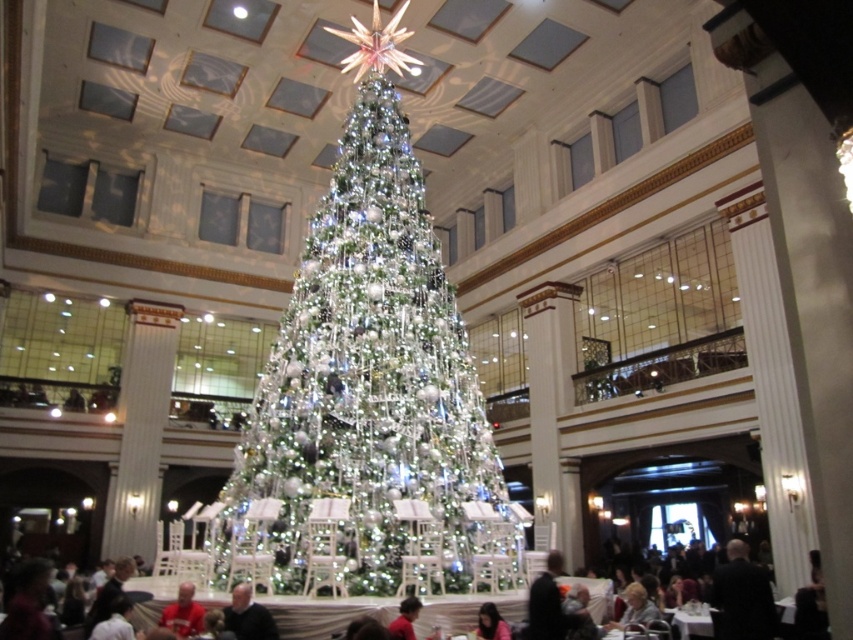
Which is above, iridescent glass christmas tree at center or smooth pink shirt at lower center?

iridescent glass christmas tree at center is above.

Is iridescent glass christmas tree at center to the left of smooth pink shirt at lower center from the viewer's perspective?

Indeed, iridescent glass christmas tree at center is positioned on the left side of smooth pink shirt at lower center.

I want to click on iridescent glass christmas tree at center, so click(369, 392).

Does black fabric at lower right have a greater height compared to dark gray suit at lower right?

Yes, black fabric at lower right is taller than dark gray suit at lower right.

Describe the element at coordinates (743, 595) in the screenshot. I see `black fabric at lower right` at that location.

The height and width of the screenshot is (640, 853). Find the location of `black fabric at lower right`. black fabric at lower right is located at coordinates (743, 595).

From the picture: Is red velvet sweater at lower center in front of smooth pink shirt at lower center?

Yes.

Does red velvet sweater at lower center lie behind smooth pink shirt at lower center?

No, red velvet sweater at lower center is closer to the viewer.

The width and height of the screenshot is (853, 640). Describe the element at coordinates (183, 612) in the screenshot. I see `red velvet sweater at lower center` at that location.

This screenshot has height=640, width=853. What are the coordinates of `red velvet sweater at lower center` in the screenshot? It's located at (183, 612).